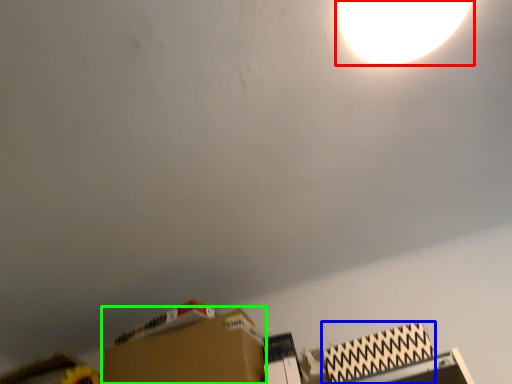
Question: Considering the real-world distances, which object is closest to lamp (highlighted by a red box)? cardboard box (highlighted by a blue box) or cardboard box (highlighted by a green box).

Choices:
 (A) cardboard box
 (B) cardboard box

Answer: (A)